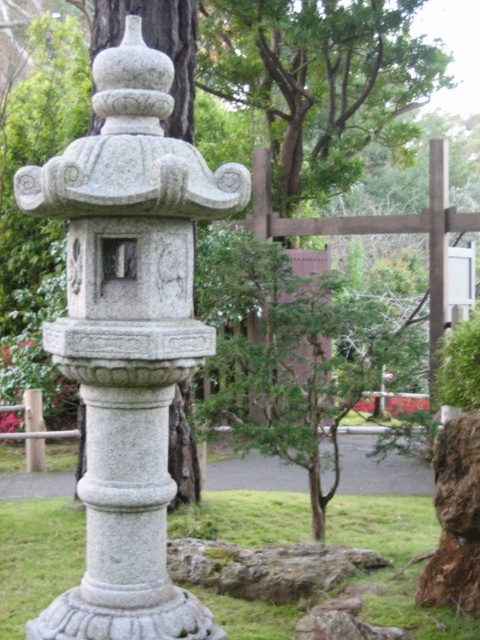
You are standing in a Japanese garden and see both the gray stone lantern at center and the gray stone pillar at center. Which object is positioned closer to you?

The gray stone lantern at center is closer to the viewer than the gray stone pillar at center.

You are a landscape architect designing a garden path that must pass between the gray stone lantern at center and the gray stone pillar at center. The path must be wide enough for a wheelbarrow. Given that the distance between them is 2 meters, can the path accommodate a wheelbarrow that is 1.5 meters wide?

The distance between the gray stone lantern at center and the gray stone pillar at center is 2 meters. Since the wheelbarrow is 1.5 meters wide, the path between them is wide enough to accommodate it.

You are a landscape architect designing a garden path that needs to pass between the gray stone lantern at center and the gray stone pillar at center. Since the path must be elevated to avoid wet soil, which object should the elevated path be positioned closer to based on their heights?

The gray stone lantern at center is taller than the gray stone pillar at center, so the elevated path should be positioned closer to the shorter gray stone pillar at center to ensure stability and proper elevation.